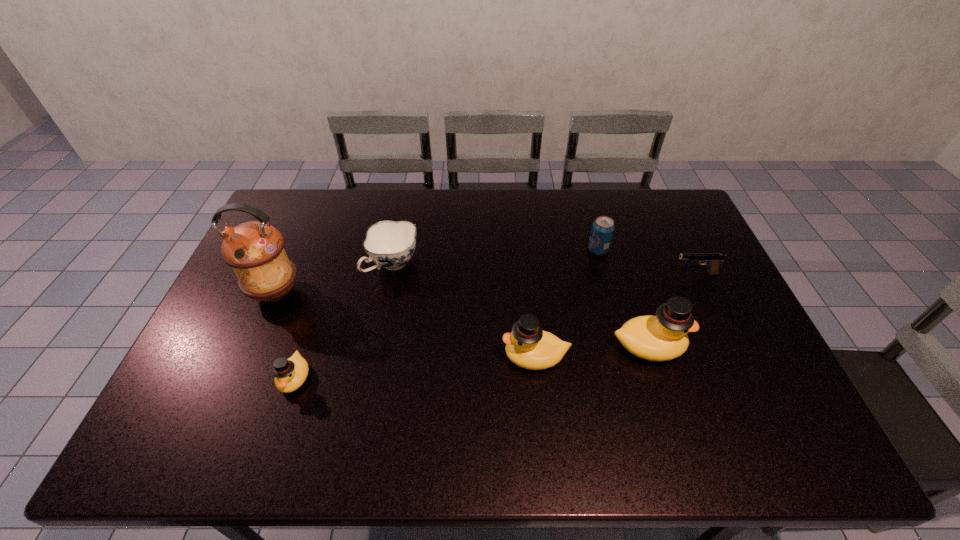
Locate an element on the screen. This screenshot has width=960, height=540. the shortest object is located at coordinates (713, 260).

The height and width of the screenshot is (540, 960). In order to click on free space located 0.150m on the front-facing side of the fourth object from left to right in this screenshot , I will do `click(445, 356)`.

The width and height of the screenshot is (960, 540). I want to click on free spot located on the front-facing side of the fourth object from left to right, so click(x=438, y=356).

This screenshot has height=540, width=960. In order to click on free space located 0.350m on the front-facing side of the fourth object from left to right in this screenshot , I will do `click(371, 356)`.

Find the location of a particular element. The image size is (960, 540). free space located 0.080m on the front-facing side of the rightmost duck is located at coordinates (716, 346).

I want to click on free space located 0.400m on the front of the pop soda, so click(x=628, y=361).

Locate an element on the screen. vacant point located 0.080m on the left of the chinaware is located at coordinates (342, 265).

Identify the location of blank space located on the right of the tallest object. Image resolution: width=960 pixels, height=540 pixels. (408, 292).

Find the location of a particular element. free space located at the muzzle of the pistol is located at coordinates (546, 274).

Locate an element on the screen. vacant space located 0.080m at the muzzle of the pistol is located at coordinates (648, 274).